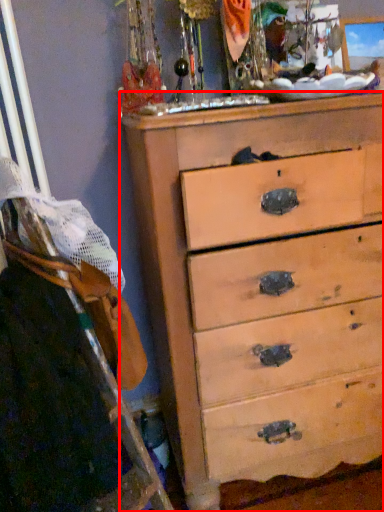
Question: From the image, what is the correct spatial relationship of chest of drawers (annotated by the red box) in relation to ladder?

Choices:
 (A) left
 (B) right

Answer: (B)